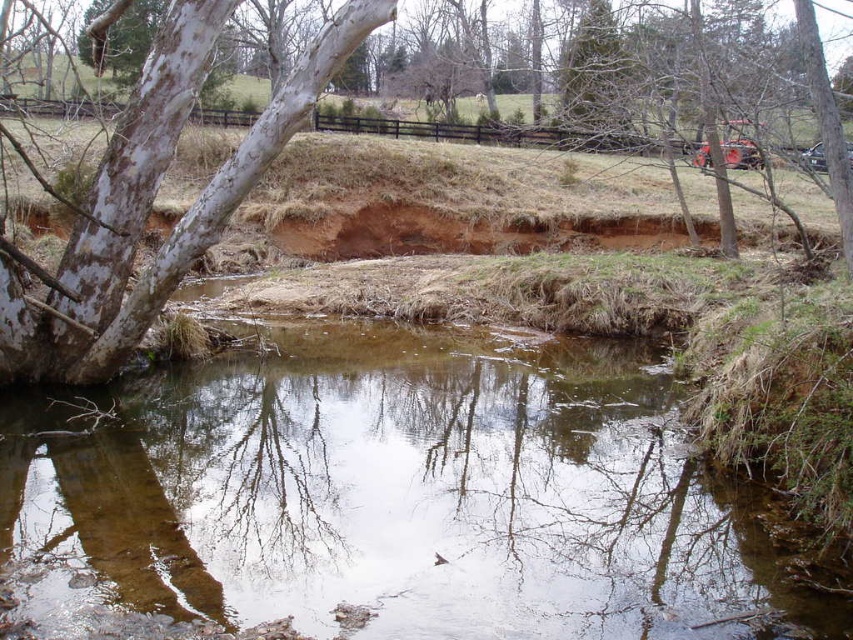
Does clear water at center appear under white smooth bark tree at upper left?

Yes, clear water at center is below white smooth bark tree at upper left.

Between clear water at center and white smooth bark tree at upper left, which one is positioned higher?

white smooth bark tree at upper left is above.

In the scene shown: Who is more distant from viewer, (244, 492) or (107, 275)?

The point (107, 275) is behind.

Identify the location of clear water at center. Image resolution: width=853 pixels, height=640 pixels. pos(389,499).